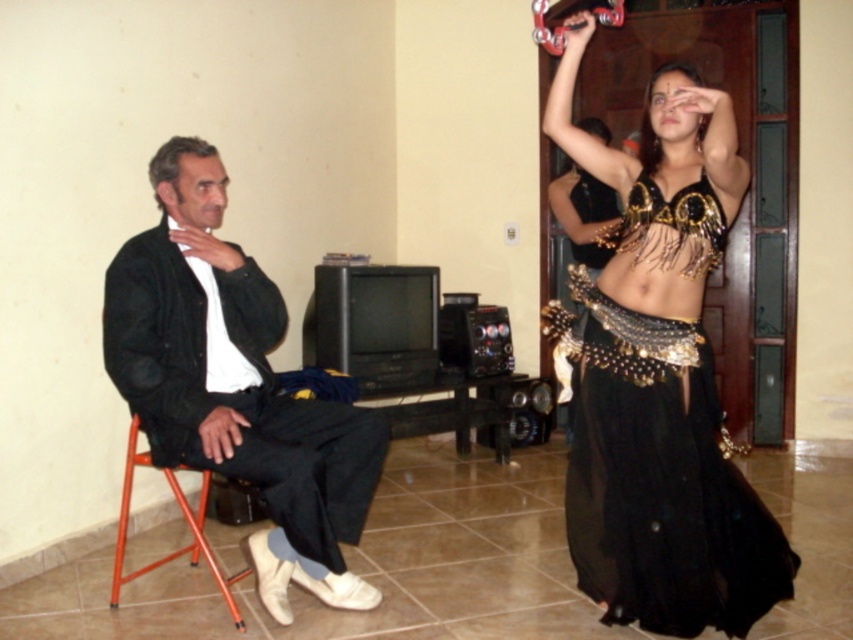
Is shiny gold sequins at upper right wider than orange metal chair at left?

No, shiny gold sequins at upper right is not wider than orange metal chair at left.

Which is in front, point (610, 253) or point (125, 580)?

Point (125, 580) is more forward.

Locate an element on the screen. The height and width of the screenshot is (640, 853). shiny gold sequins at upper right is located at coordinates (583, 212).

Does black satin belly dancer at upper right appear on the left side of black fabric jacket at left?

In fact, black satin belly dancer at upper right is to the right of black fabric jacket at left.

Between black satin belly dancer at upper right and black fabric jacket at left, which one is positioned higher?

black satin belly dancer at upper right is higher up.

The height and width of the screenshot is (640, 853). Find the location of `black satin belly dancer at upper right`. black satin belly dancer at upper right is located at coordinates (659, 374).

At what (x,y) coordinates should I click in order to perform the action: click on black satin belly dancer at upper right. Please return your answer as a coordinate pair (x, y). The image size is (853, 640). Looking at the image, I should click on [659, 374].

Does black satin belly dancer at upper right have a lesser width compared to orange metal chair at left?

In fact, black satin belly dancer at upper right might be wider than orange metal chair at left.

Which is more to the right, black satin belly dancer at upper right or orange metal chair at left?

Positioned to the right is black satin belly dancer at upper right.

Find the location of a particular element. The width and height of the screenshot is (853, 640). black satin belly dancer at upper right is located at coordinates (659, 374).